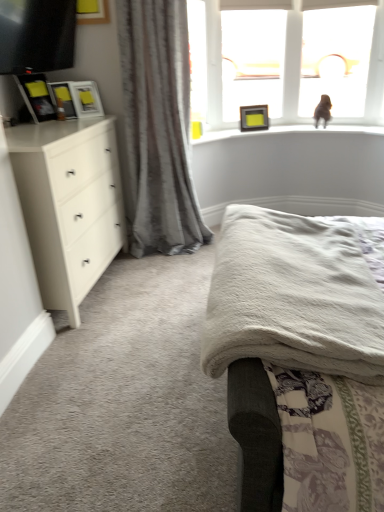
Question: Is white soft bed at upper center to the left of white matte chest of drawers at left from the viewer's perspective?

Choices:
 (A) no
 (B) yes

Answer: (A)

Question: Can you confirm if white soft bed at upper center is positioned to the right of white matte chest of drawers at left?

Choices:
 (A) no
 (B) yes

Answer: (B)

Question: Is white soft bed at upper center not within white matte chest of drawers at left?

Choices:
 (A) no
 (B) yes

Answer: (B)

Question: Is white soft bed at upper center thinner than white matte chest of drawers at left?

Choices:
 (A) no
 (B) yes

Answer: (A)

Question: Does white soft bed at upper center turn towards white matte chest of drawers at left?

Choices:
 (A) yes
 (B) no

Answer: (A)

Question: Considering the positions of transparent glass window at upper right, placed as the first window screen when sorted from right to left, and matte black picture frame at upper center, which is the 1th picture frame from back to front, in the image, is transparent glass window at upper right, placed as the first window screen when sorted from right to left, taller or shorter than matte black picture frame at upper center, which is the 1th picture frame from back to front,?

Choices:
 (A) tall
 (B) short

Answer: (A)

Question: From the image's perspective, is transparent glass window at upper right, the 2th window screen positioned from the left, positioned above or below matte black picture frame at upper center, which is counted as the fourth picture frame, starting from the front?

Choices:
 (A) above
 (B) below

Answer: (A)

Question: Is transparent glass window at upper right, placed as the first window screen when sorted from right to left, bigger or smaller than matte black picture frame at upper center, which is counted as the fourth picture frame, starting from the front?

Choices:
 (A) small
 (B) big

Answer: (B)

Question: Considering their positions, is transparent glass window at upper right, the 2th window screen positioned from the left, located in front of or behind matte black picture frame at upper center, which is the 1th picture frame from back to front?

Choices:
 (A) front
 (B) behind

Answer: (A)

Question: From the image's perspective, is matte black tv at upper left above or below matte black picture frame at upper center, which is the 1th picture frame from back to front?

Choices:
 (A) above
 (B) below

Answer: (A)

Question: In the image, is matte black tv at upper left on the left side or the right side of matte black picture frame at upper center, which is the 1th picture frame from back to front?

Choices:
 (A) left
 (B) right

Answer: (A)

Question: Looking at their shapes, would you say matte black tv at upper left is wider or thinner than matte black picture frame at upper center, acting as the 4th picture frame starting from the left?

Choices:
 (A) wide
 (B) thin

Answer: (A)

Question: From a real-world perspective, is matte black tv at upper left positioned above or below matte black picture frame at upper center, the 1th picture frame from the right?

Choices:
 (A) above
 (B) below

Answer: (A)

Question: Looking at the image, does matte white picture frame at upper left, marked as the third picture frame in a left-to-right arrangement, seem bigger or smaller compared to white matte chest of drawers at left?

Choices:
 (A) small
 (B) big

Answer: (A)

Question: Choose the correct answer: Is matte white picture frame at upper left, which is the second picture frame from back to front, inside white matte chest of drawers at left or outside it?

Choices:
 (A) outside
 (B) inside

Answer: (A)